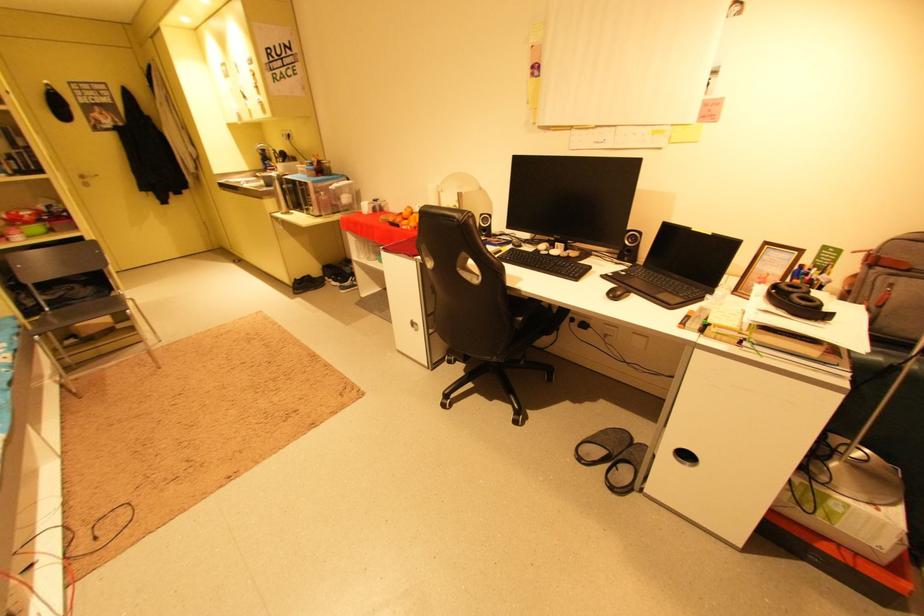
Locate an element on the screen. This screenshot has height=616, width=924. black computer mouse is located at coordinates (617, 293).